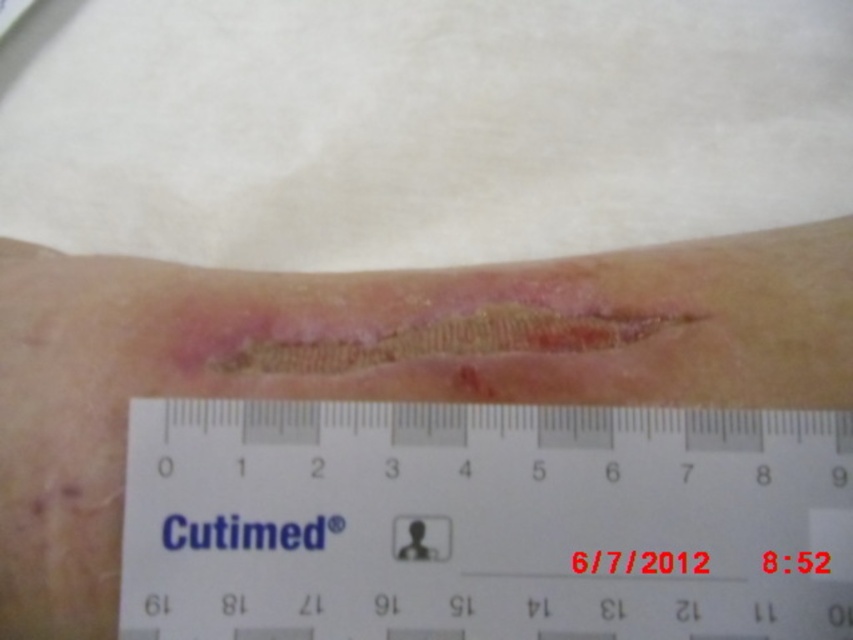
Does white paper ruler at center have a lesser width compared to dry scabbed skin at center?

Yes.

Who is shorter, white paper ruler at center or dry scabbed skin at center?

Standing shorter between the two is white paper ruler at center.

Find the location of a particular element. The width and height of the screenshot is (853, 640). white paper ruler at center is located at coordinates (485, 522).